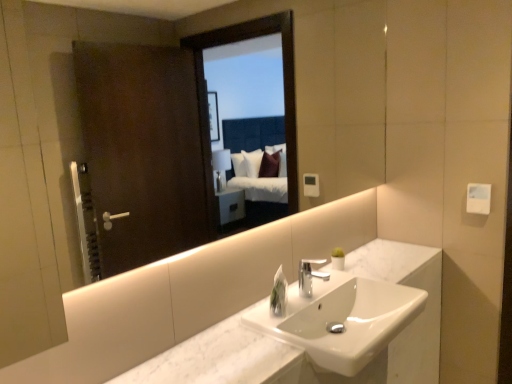
Question: From a real-world perspective, does clear plastic soap dispenser at center sit lower than white marble sink at center?

Choices:
 (A) yes
 (B) no

Answer: (B)

Question: From the image's perspective, is clear plastic soap dispenser at center under white marble sink at center?

Choices:
 (A) yes
 (B) no

Answer: (B)

Question: Is clear plastic soap dispenser at center outside of white marble sink at center?

Choices:
 (A) no
 (B) yes

Answer: (B)

Question: Does clear plastic soap dispenser at center have a greater height compared to white marble sink at center?

Choices:
 (A) yes
 (B) no

Answer: (B)

Question: Considering the relative positions of clear plastic soap dispenser at center and white marble sink at center in the image provided, is clear plastic soap dispenser at center behind white marble sink at center?

Choices:
 (A) no
 (B) yes

Answer: (B)

Question: Considering the relative sizes of clear plastic soap dispenser at center and white marble sink at center in the image provided, is clear plastic soap dispenser at center wider than white marble sink at center?

Choices:
 (A) yes
 (B) no

Answer: (B)

Question: Could clear plastic soap dispenser at center be considered to be inside white marble sink at center?

Choices:
 (A) yes
 (B) no

Answer: (B)

Question: Considering the relative sizes of white marble sink at center and clear plastic soap dispenser at center in the image provided, is white marble sink at center smaller than clear plastic soap dispenser at center?

Choices:
 (A) yes
 (B) no

Answer: (B)

Question: From a real-world perspective, is white marble sink at center below clear plastic soap dispenser at center?

Choices:
 (A) yes
 (B) no

Answer: (A)

Question: Considering the relative sizes of white marble sink at center and clear plastic soap dispenser at center in the image provided, is white marble sink at center wider than clear plastic soap dispenser at center?

Choices:
 (A) no
 (B) yes

Answer: (B)

Question: Is clear plastic soap dispenser at center at the back of white marble sink at center?

Choices:
 (A) no
 (B) yes

Answer: (A)

Question: Does white marble sink at center turn towards clear plastic soap dispenser at center?

Choices:
 (A) no
 (B) yes

Answer: (A)

Question: From a real-world perspective, is clear plastic soap dispenser at center beneath silver metallic faucet at center?

Choices:
 (A) no
 (B) yes

Answer: (B)